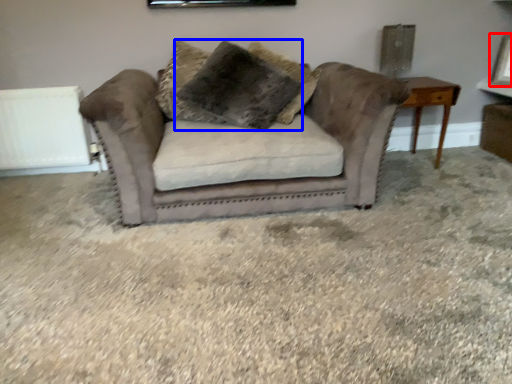
Question: Which object appears farthest to the camera in this image, picture frame (highlighted by a red box) or pillow (highlighted by a blue box)?

Choices:
 (A) picture frame
 (B) pillow

Answer: (A)